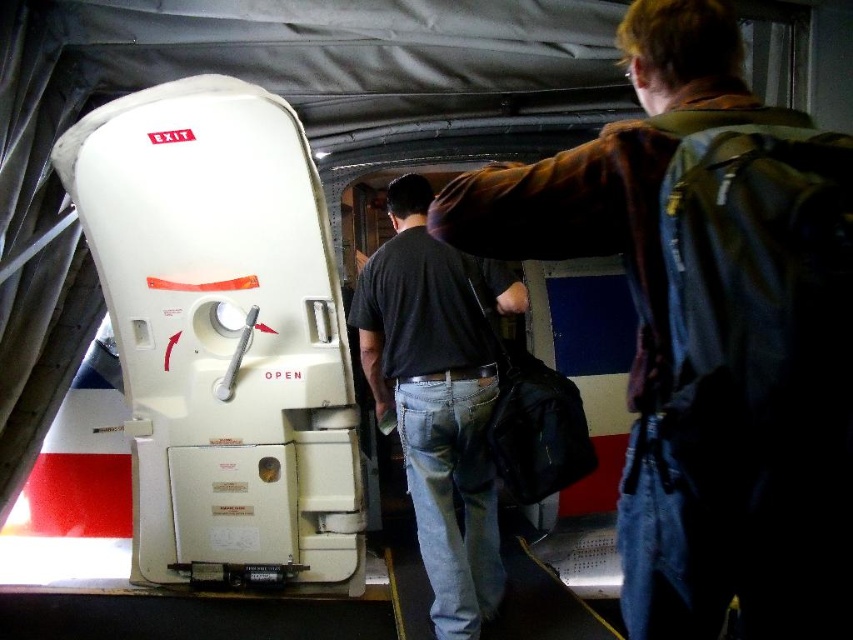
Consider the image. Can you confirm if denim jacket at upper right is thinner than dark blue jeans at center?

In fact, denim jacket at upper right might be wider than dark blue jeans at center.

Can you confirm if denim jacket at upper right is positioned above dark blue jeans at center?

Yes.

Find the location of a particular element. The height and width of the screenshot is (640, 853). denim jacket at upper right is located at coordinates (708, 326).

You are a GUI agent. You are given a task and a screenshot of the screen. Output one action in this format:
    pyautogui.click(x=<x>, y=<y>)
    Task: Click on the denim jacket at upper right
    This screenshot has width=853, height=640.
    Given the screenshot: What is the action you would take?
    pyautogui.click(x=708, y=326)